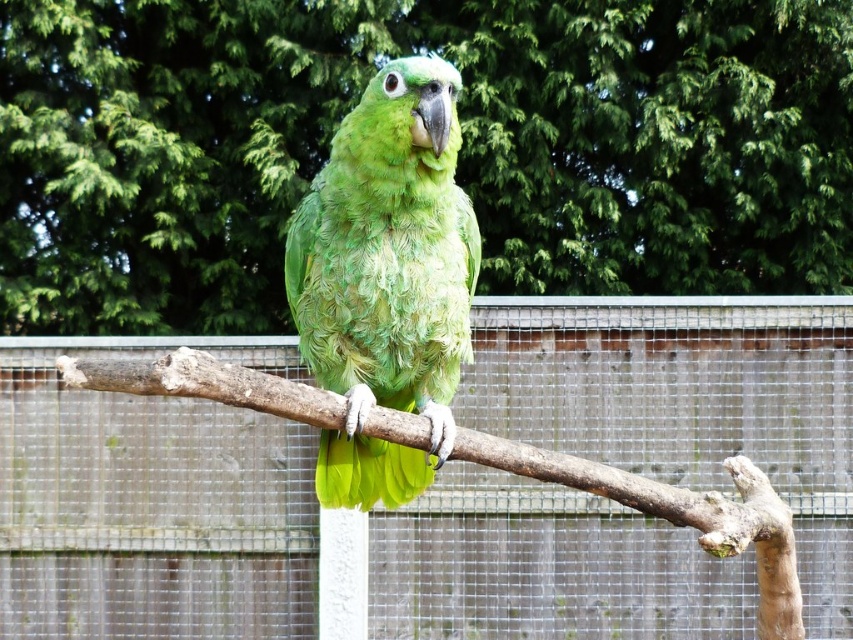
In the scene, you see a green leafy tree at center and a green matte parrot at center. Which object is larger in size?

The green leafy tree at center is bigger than the green matte parrot at center.

You are a bird sitting on the green leafy tree at center. You want to fly to the metallic wire mesh at center. Which direction should you fly to reach it?

The metallic wire mesh at center is located to the right side of the green leafy tree at center, so you should fly towards the right to reach it.

You are a bird trainer who wants to place a treat for the parrot. The treat is a small piece of fruit. Where should you place the treat so that it is closest to the metallic wire mesh at center?

The metallic wire mesh at center is located at point (151,500). To place the treat closest to it, you should position the treat near the coordinates provided.